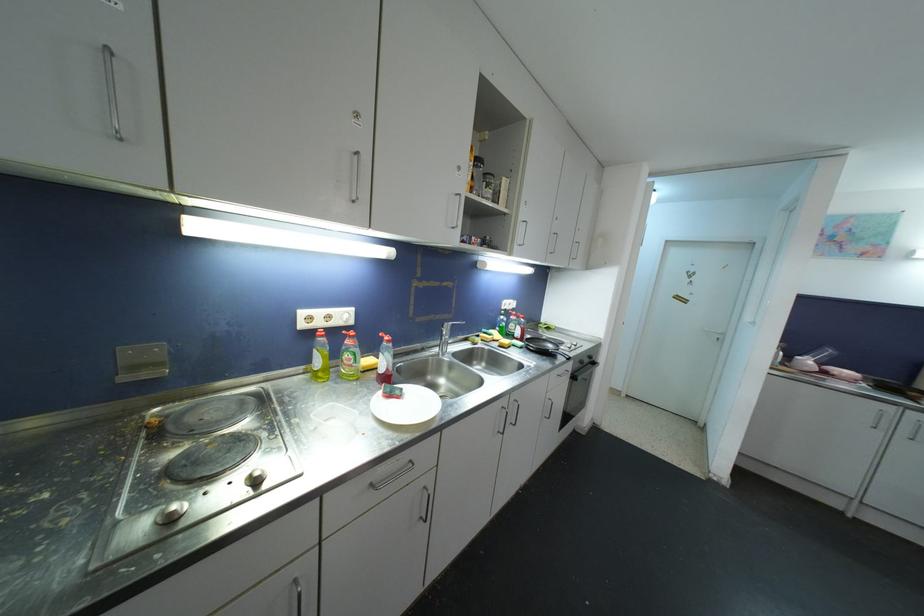
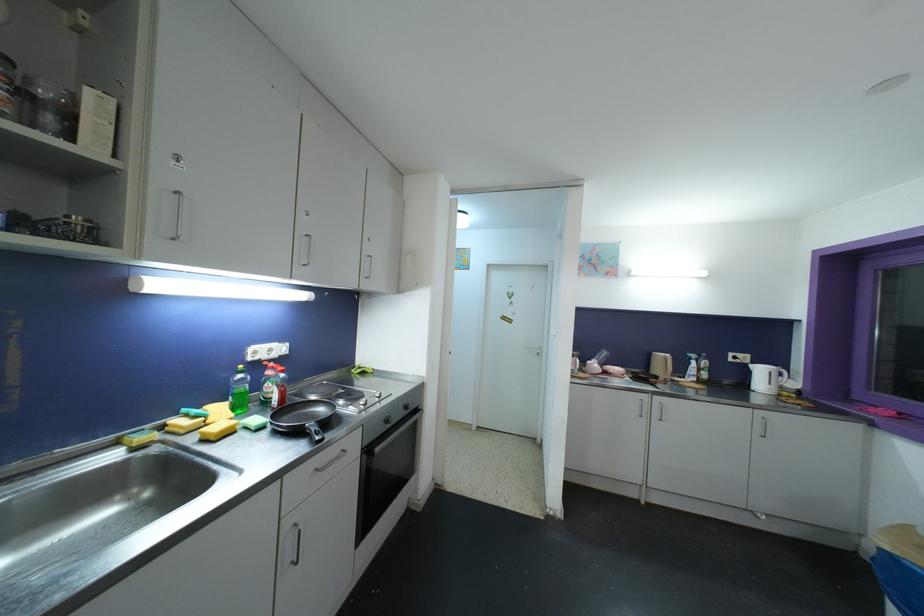
Find the pixel in the second image that matches (505,320) in the first image.

(244, 379)